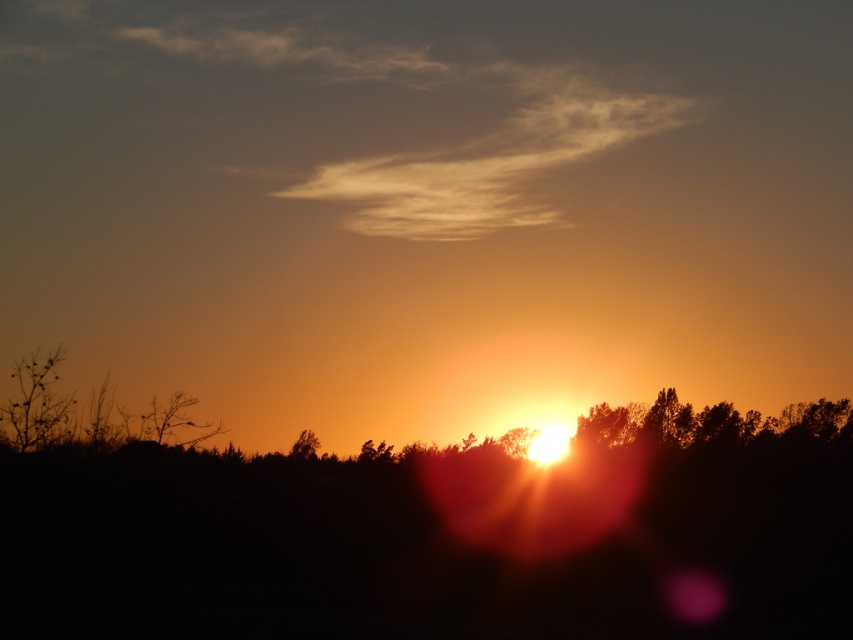
You are an artist trying to paint the sunset scene. You want to ensure the bare branches at left and the silky brown tree at center are proportionally accurate. Which object should you paint wider?

The bare branches at left should be painted wider since their width is larger than the silky brown tree at center according to the description.